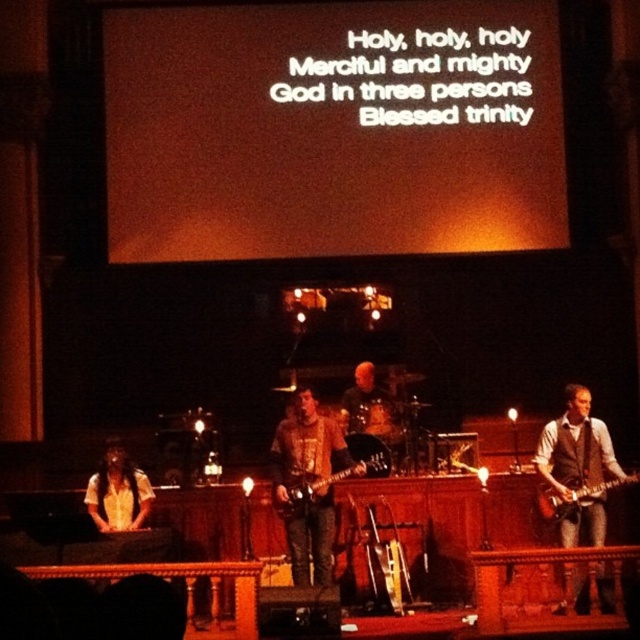
Question: Is brown leather guitar at center below brown leather vest at right?

Choices:
 (A) yes
 (B) no

Answer: (B)

Question: Which object is closer to the camera taking this photo?

Choices:
 (A) glossy electric guitar at right
 (B) glossy electric guitar at center

Answer: (A)

Question: Among these objects, which one is farthest from the camera?

Choices:
 (A) glossy electric guitar at right
 (B) white shirt at lower left
 (C) brown leather guitar at center

Answer: (B)

Question: Is brown leather vest at right thinner than glossy electric guitar at right?

Choices:
 (A) no
 (B) yes

Answer: (A)

Question: Does brown leather guitar at center have a larger size compared to brown leather vest at right?

Choices:
 (A) yes
 (B) no

Answer: (A)

Question: Which point appears farthest from the camera in this image?

Choices:
 (A) (381, 454)
 (B) (291, 538)

Answer: (A)